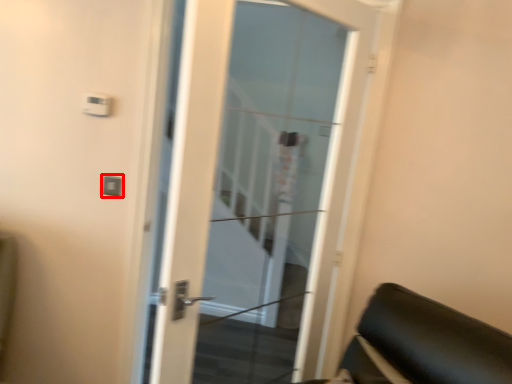
Question: From the image's perspective, what is the correct spatial relationship of light switch (annotated by the red box) in relation to door?

Choices:
 (A) above
 (B) below

Answer: (A)